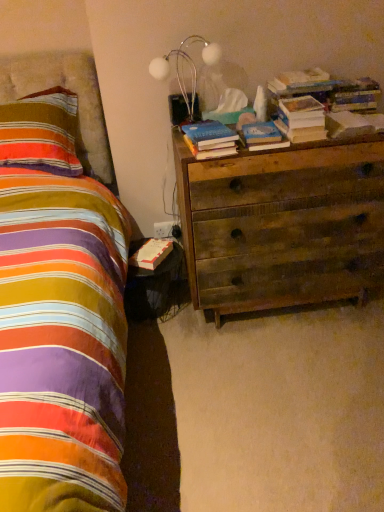
Question: From a real-world perspective, is hardcover book at center, which is the 1th book in left-to-right order, beneath striped fabric pillow at left?

Choices:
 (A) no
 (B) yes

Answer: (A)

Question: Does hardcover book at center, marked as the 2th book in a right-to-left arrangement, lie behind striped fabric pillow at left?

Choices:
 (A) yes
 (B) no

Answer: (B)

Question: Considering the relative positions of hardcover book at center, marked as the 2th book in a right-to-left arrangement, and striped fabric pillow at left in the image provided, is hardcover book at center, marked as the 2th book in a right-to-left arrangement, to the right of striped fabric pillow at left from the viewer's perspective?

Choices:
 (A) yes
 (B) no

Answer: (A)

Question: Is striped fabric pillow at left at the back of hardcover book at center, which is the 1th book in left-to-right order?

Choices:
 (A) yes
 (B) no

Answer: (B)

Question: Can you confirm if hardcover book at center, marked as the 2th book in a right-to-left arrangement, is positioned to the left of striped fabric pillow at left?

Choices:
 (A) no
 (B) yes

Answer: (A)

Question: Could you tell me if hardcover book at center, which is the 1th book in left-to-right order, is facing striped fabric pillow at left?

Choices:
 (A) no
 (B) yes

Answer: (A)

Question: Is hardcover book at upper right, which ranks as the second paperback book in back-to-front order, completely or partially outside of black glossy nightstand at lower left?

Choices:
 (A) no
 (B) yes

Answer: (B)

Question: From the image's perspective, is hardcover book at upper right, which ranks as the second paperback book in back-to-front order, on top of black glossy nightstand at lower left?

Choices:
 (A) no
 (B) yes

Answer: (B)

Question: Does hardcover book at upper right, which ranks as the second paperback book in back-to-front order, lie in front of black glossy nightstand at lower left?

Choices:
 (A) no
 (B) yes

Answer: (B)

Question: Is hardcover book at upper right, which is the 2th paperback book in front-to-back order, to the left of black glossy nightstand at lower left from the viewer's perspective?

Choices:
 (A) no
 (B) yes

Answer: (A)

Question: Would you say hardcover book at upper right, the first paperback book from the right, contains black glossy nightstand at lower left?

Choices:
 (A) yes
 (B) no

Answer: (B)

Question: Is hardcover book at upper right, which is the third paperback book in left-to-right order, directly adjacent to black glossy nightstand at lower left?

Choices:
 (A) yes
 (B) no

Answer: (B)

Question: Is hardcover book at center, which is the 1th paperback book in front-to-back order, inside hardcover book at upper right, placed as the 3th paperback book when sorted from bottom to top?

Choices:
 (A) no
 (B) yes

Answer: (A)